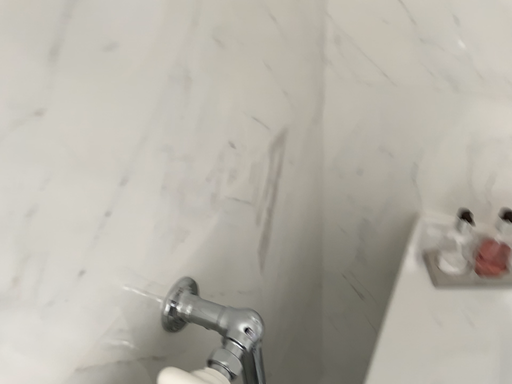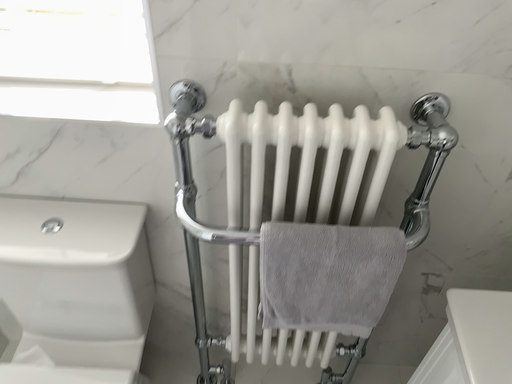
Question: How did the camera likely rotate when shooting the video?

Choices:
 (A) rotated upward
 (B) rotated downward

Answer: (A)